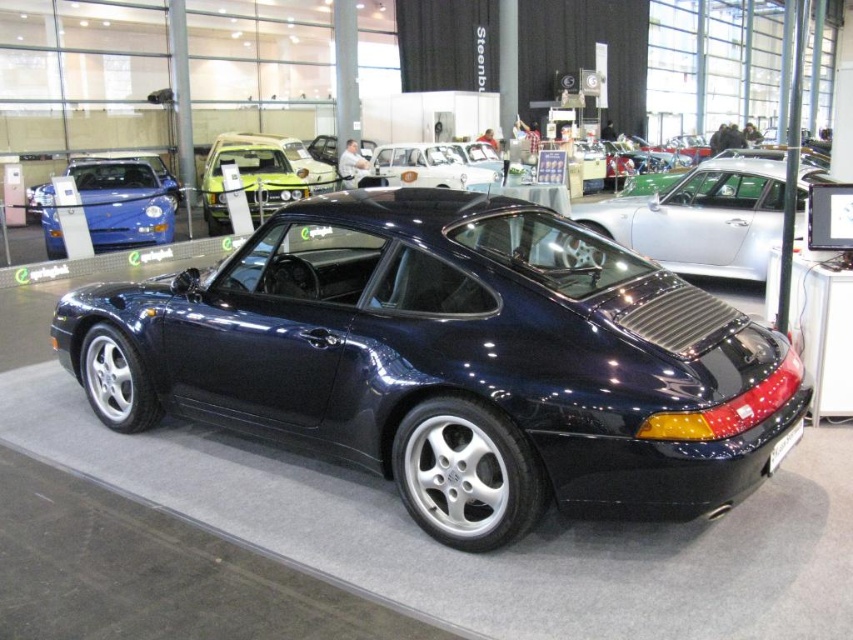
Question: Does satin silver sedan at center appear under white glossy sedan at center?

Choices:
 (A) no
 (B) yes

Answer: (B)

Question: Is satin silver sedan at center below matte green car at center?

Choices:
 (A) no
 (B) yes

Answer: (B)

Question: Which is nearer to the black plastic license plate at rear?

Choices:
 (A) satin silver sedan at center
 (B) glossy dark blue car at center
 (C) white glossy sedan at center
 (D) matte green car at center

Answer: (B)

Question: Which of the following is the farthest from the observer?

Choices:
 (A) (109, 236)
 (B) (675, 264)
 (C) (378, 147)
 (D) (782, 435)

Answer: (C)

Question: Which point appears closest to the camera in this image?

Choices:
 (A) (798, 179)
 (B) (323, 189)
 (C) (445, 156)
 (D) (770, 449)

Answer: (D)

Question: Does matte blue sedan at left appear under black plastic license plate at rear?

Choices:
 (A) no
 (B) yes

Answer: (A)